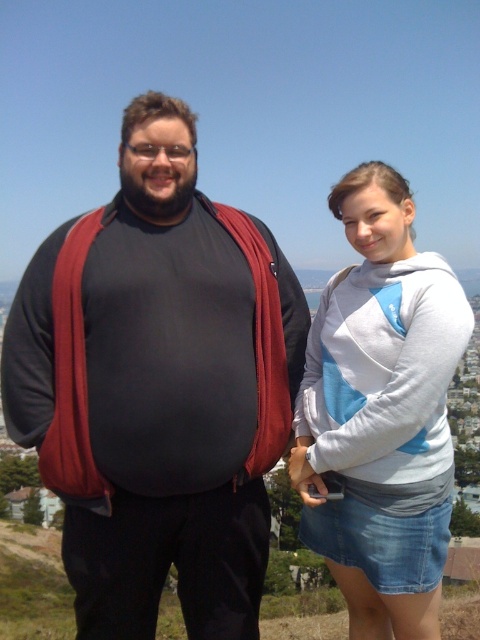
You are planning to carry both the matte black backpack at left and the gray cotton hoodie at upper right in a bag that has a width capacity of 30 cm. Based on their sizes, can both items fit side by side in the bag?

The matte black backpack at left might be wider than gray cotton hoodie at upper right. If the backpack is wider than 30 cm, they won